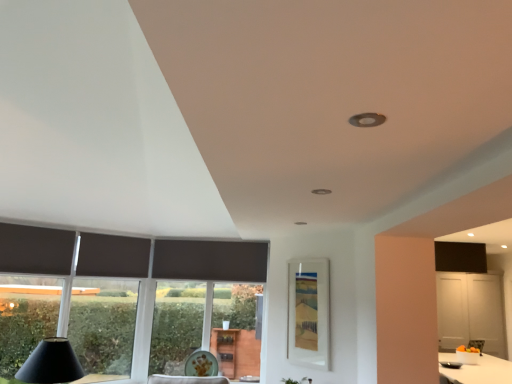
Question: Considering the relative sizes of dark matte curtain at left, which is the first curtain in front-to-back order, and transparent glass window at left in the image provided, is dark matte curtain at left, which is the first curtain in front-to-back order, wider than transparent glass window at left?

Choices:
 (A) yes
 (B) no

Answer: (B)

Question: Can you confirm if dark matte curtain at left, which is the second curtain in right-to-left order, is smaller than transparent glass window at left?

Choices:
 (A) yes
 (B) no

Answer: (A)

Question: Can you confirm if dark matte curtain at left, the 1th curtain positioned from the left, is thinner than transparent glass window at left?

Choices:
 (A) yes
 (B) no

Answer: (A)

Question: Is dark matte curtain at left, which is the second curtain in right-to-left order, bigger than transparent glass window at left?

Choices:
 (A) yes
 (B) no

Answer: (B)

Question: Can we say dark matte curtain at left, the 1th curtain positioned from the left, lies outside transparent glass window at left?

Choices:
 (A) no
 (B) yes

Answer: (B)

Question: Is dark matte curtain at left, the 1th curtain positioned from the left, next to transparent glass window at left?

Choices:
 (A) yes
 (B) no

Answer: (B)

Question: From a real-world perspective, does dark matte curtain at left, arranged as the second curtain when viewed from the back, sit lower than matte black cone at lower left?

Choices:
 (A) no
 (B) yes

Answer: (A)

Question: Does dark matte curtain at left, arranged as the second curtain when viewed from the back, have a larger size compared to matte black cone at lower left?

Choices:
 (A) no
 (B) yes

Answer: (A)

Question: Is dark matte curtain at left, the 1th curtain positioned from the left, positioned with its back to matte black cone at lower left?

Choices:
 (A) yes
 (B) no

Answer: (B)

Question: Can you confirm if dark matte curtain at left, which is the first curtain in front-to-back order, is smaller than matte black cone at lower left?

Choices:
 (A) yes
 (B) no

Answer: (A)

Question: Does dark matte curtain at left, which is the first curtain in front-to-back order, turn towards matte black cone at lower left?

Choices:
 (A) no
 (B) yes

Answer: (A)

Question: Is the position of dark matte curtain at left, arranged as the second curtain when viewed from the back, more distant than that of matte black cone at lower left?

Choices:
 (A) yes
 (B) no

Answer: (A)

Question: Considering the relative positions of transparent glass window at left and matte glass window screen at center in the image provided, is transparent glass window at left to the left of matte glass window screen at center from the viewer's perspective?

Choices:
 (A) no
 (B) yes

Answer: (B)